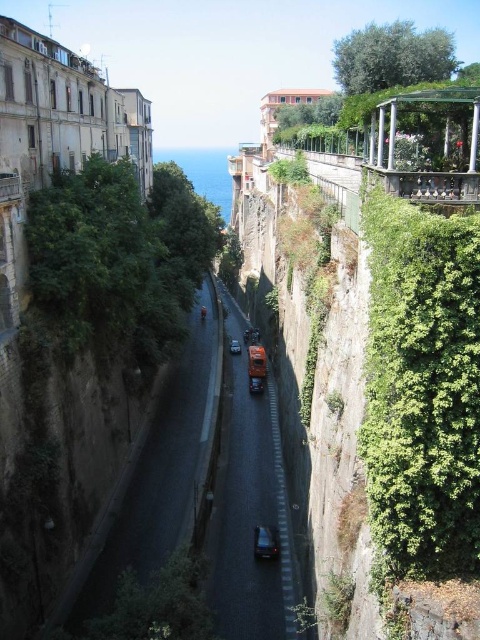
Question: Can you confirm if black asphalt road at center is thinner than shiny black car at center?

Choices:
 (A) yes
 (B) no

Answer: (B)

Question: Which point is closer to the camera?

Choices:
 (A) (387, 214)
 (B) (257, 552)
 (C) (230, 353)
 (D) (255, 392)

Answer: (A)

Question: Does black asphalt road at center appear under shiny black car at center?

Choices:
 (A) yes
 (B) no

Answer: (B)

Question: Does metallic silver car at center have a lesser width compared to shiny metallic car at center?

Choices:
 (A) no
 (B) yes

Answer: (B)

Question: Which point is closer to the camera?

Choices:
 (A) (254, 528)
 (B) (262, 384)
 (C) (232, 502)
 (D) (286, 611)

Answer: (D)

Question: Among these points, which one is nearest to the camera?

Choices:
 (A) (267, 573)
 (B) (233, 340)

Answer: (A)